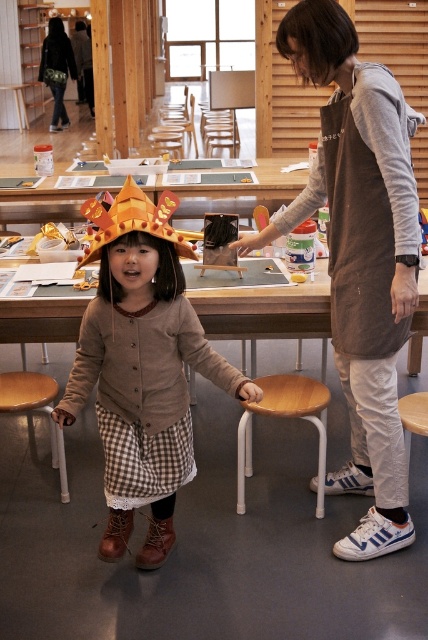
Question: Can you confirm if wooden table at center is bigger than dark gray fabric bag at upper left?

Choices:
 (A) yes
 (B) no

Answer: (B)

Question: In this image, where is matte orange paper crown at center located relative to dark gray fabric bag at upper left?

Choices:
 (A) left
 (B) right

Answer: (B)

Question: Which of the following is the closest to the observer?

Choices:
 (A) (243, 424)
 (B) (62, 300)
 (C) (371, 88)
 (D) (166, 401)

Answer: (C)

Question: Which point is farther from the camera taking this photo?

Choices:
 (A) (59, 38)
 (B) (44, 406)
 (C) (237, 310)
 (D) (265, 408)

Answer: (A)

Question: Does gray cotton apron at center appear on the right side of dark gray fabric bag at upper left?

Choices:
 (A) yes
 (B) no

Answer: (A)

Question: Based on their relative distances, which object is nearer to the wooden table at center?

Choices:
 (A) wooden seat at center
 (B) gray cotton apron at center
 (C) wooden stool at lower left
 (D) matte orange paper crown at center

Answer: (A)